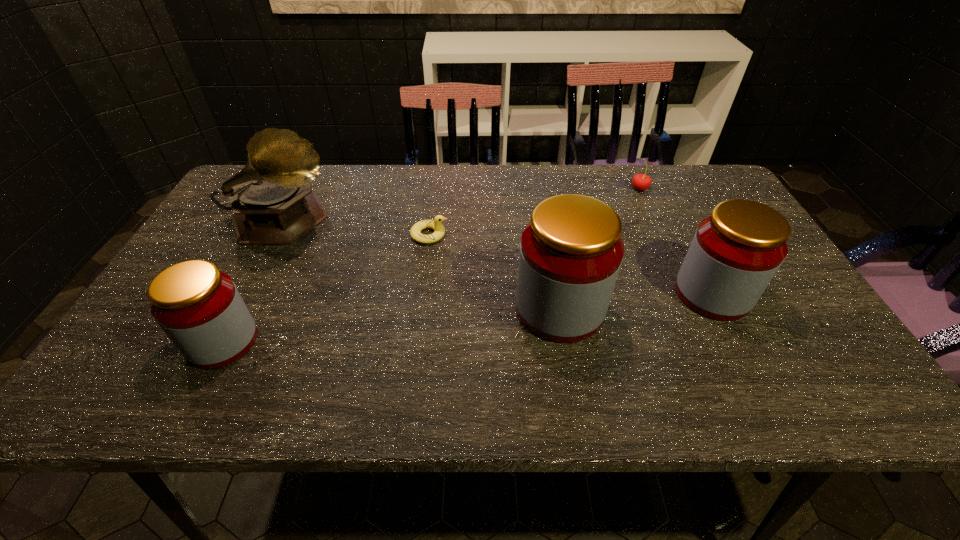
Where is `unoccupied area between the phonograph record and the second shortest object`? The height and width of the screenshot is (540, 960). unoccupied area between the phonograph record and the second shortest object is located at coordinates (462, 205).

What are the coordinates of `vacant point located between the rightmost jar and the fifth tallest object` in the screenshot? It's located at (676, 241).

At what (x,y) coordinates should I click in order to perform the action: click on unoccupied area between the fourth shortest object and the cherry. Please return your answer as a coordinate pair (x, y). The height and width of the screenshot is (540, 960). Looking at the image, I should click on (676, 241).

In order to click on vacant region between the cherry and the phonograph record in this screenshot , I will do `click(462, 205)`.

Find the location of a particular element. The height and width of the screenshot is (540, 960). vacant space that is in between the fourth object from left to right and the rightmost jar is located at coordinates (636, 301).

Identify which object is the fourth nearest to the shortest jar. Please provide its 2D coordinates. Your answer should be formatted as a tuple, i.e. [(x, y)], where the tuple contains the x and y coordinates of a point satisfying the conditions above.

[(736, 251)]

Locate an element on the screen. Image resolution: width=960 pixels, height=540 pixels. object that ranks as the fourth closest to the fourth object from left to right is located at coordinates (272, 201).

Select which jar appears as the second closest to the cherry. Please provide its 2D coordinates. Your answer should be formatted as a tuple, i.e. [(x, y)], where the tuple contains the x and y coordinates of a point satisfying the conditions above.

[(571, 251)]

Identify which jar is the second closest to the third object from left to right. Please provide its 2D coordinates. Your answer should be formatted as a tuple, i.e. [(x, y)], where the tuple contains the x and y coordinates of a point satisfying the conditions above.

[(199, 308)]

This screenshot has width=960, height=540. What are the coordinates of `free space that satisfies the following two spatial constraints: 1. on the back side of the third object from right to left; 2. on the right side of the fifth tallest object` in the screenshot? It's located at 540,189.